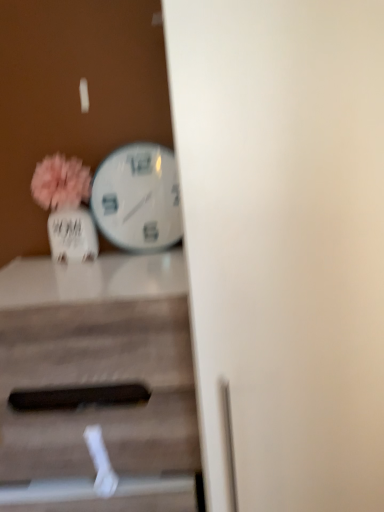
The image size is (384, 512). In order to click on matte white vase at left in this screenshot , I will do (66, 207).

Between white glossy wall clock at center-left and wooden table at center, which one has larger size?

wooden table at center.

Is white glossy wall clock at center-left in front of or behind wooden table at center in the image?

Clearly, white glossy wall clock at center-left is behind wooden table at center.

How different are the orientations of white glossy wall clock at center-left and wooden table at center in degrees?

There is a 1.85-degree angle between the facing directions of white glossy wall clock at center-left and wooden table at center.

Is white glossy wall clock at center-left to the right of wooden table at center from the viewer's perspective?

Correct, you'll find white glossy wall clock at center-left to the right of wooden table at center.

From a real-world perspective, which is physically above, wooden table at center or matte white vase at left?

matte white vase at left.

From the image's perspective, which object appears higher, wooden table at center or matte white vase at left?

From the image's view, matte white vase at left is above.

Is wooden table at center looking in the opposite direction of matte white vase at left?

wooden table at center does not have its back to matte white vase at left.

Identify the location of table below the matte white vase at left (from a real-world perspective). The image size is (384, 512). (98, 381).

Considering the relative positions of matte white vase at left and white glossy wall clock at center-left in the image provided, is matte white vase at left to the left or to the right of white glossy wall clock at center-left?

In the image, matte white vase at left appears on the left side of white glossy wall clock at center-left.

Measure the distance between matte white vase at left and white glossy wall clock at center-left.

matte white vase at left is 4.55 inches from white glossy wall clock at center-left.

From the picture: Is matte white vase at left inside or outside of white glossy wall clock at center-left?

matte white vase at left lies outside white glossy wall clock at center-left.

In the scene shown: Could you tell me if matte white vase at left is turned towards white glossy wall clock at center-left?

No, matte white vase at left is not aimed at white glossy wall clock at center-left.

Looking at this image, from a real-world perspective, who is located higher, white glossy wall clock at center-left or matte white vase at left?

white glossy wall clock at center-left.

What's the angular difference between white glossy wall clock at center-left and matte white vase at left's facing directions?

0.147 degrees.

Is white glossy wall clock at center-left not near matte white vase at left?

That's not correct — white glossy wall clock at center-left is a little close to matte white vase at left.

Which object is further away from the camera, white glossy wall clock at center-left or matte white vase at left?

Positioned behind is white glossy wall clock at center-left.

Is wooden table at center wider than white glossy wall clock at center-left?

Yes, wooden table at center is wider than white glossy wall clock at center-left.

From the image's perspective, is wooden table at center beneath white glossy wall clock at center-left?

Correct, wooden table at center appears lower than white glossy wall clock at center-left in the image.

Looking at this image, relative to white glossy wall clock at center-left, is wooden table at center in front or behind?

wooden table at center is in front of white glossy wall clock at center-left.

From their relative heights in the image, would you say wooden table at center is taller or shorter than white glossy wall clock at center-left?

Considering their sizes, wooden table at center has more height than white glossy wall clock at center-left.

Is wooden table at center at the back of matte white vase at left?

No, wooden table at center is not at the back of matte white vase at left.

Which of these two, matte white vase at left or wooden table at center, stands taller?

wooden table at center is taller.

From the image's perspective, is matte white vase at left above wooden table at center?

Yes, from the image's perspective, matte white vase at left is on top of wooden table at center.

Is matte white vase at left at the right side of wooden table at center?

No, matte white vase at left is not to the right of wooden table at center.

Locate an element on the screen. wall clock on the right of wooden table at center is located at coordinates (138, 198).

Where is `table located in front of the matte white vase at left`? This screenshot has height=512, width=384. table located in front of the matte white vase at left is located at coordinates [x=98, y=381].

In the scene shown: Estimate the real-world distances between objects in this image. Which object is further from matte white vase at left, white glossy wall clock at center-left or wooden table at center?

Among the two, wooden table at center is located further to matte white vase at left.

From the picture: Considering their positions, is matte white vase at left positioned closer to wooden table at center than white glossy wall clock at center-left?

Based on the image, matte white vase at left appears to be nearer to wooden table at center.

Looking at the image, which one is located closer to matte white vase at left, wooden table at center or white glossy wall clock at center-left?

white glossy wall clock at center-left is closer to matte white vase at left.

Based on their spatial positions, is white glossy wall clock at center-left or matte white vase at left further from wooden table at center?

Among the two, white glossy wall clock at center-left is located further to wooden table at center.

From the image, which object appears to be farther from white glossy wall clock at center-left, matte white vase at left or wooden table at center?

wooden table at center is positioned further to the anchor white glossy wall clock at center-left.

From the image, which object appears to be nearer to white glossy wall clock at center-left, wooden table at center or matte white vase at left?

matte white vase at left is positioned closer to the anchor white glossy wall clock at center-left.

Where is `floral arrangement between white glossy wall clock at center-left and wooden table at center from top to bottom`? floral arrangement between white glossy wall clock at center-left and wooden table at center from top to bottom is located at coordinates (66, 207).